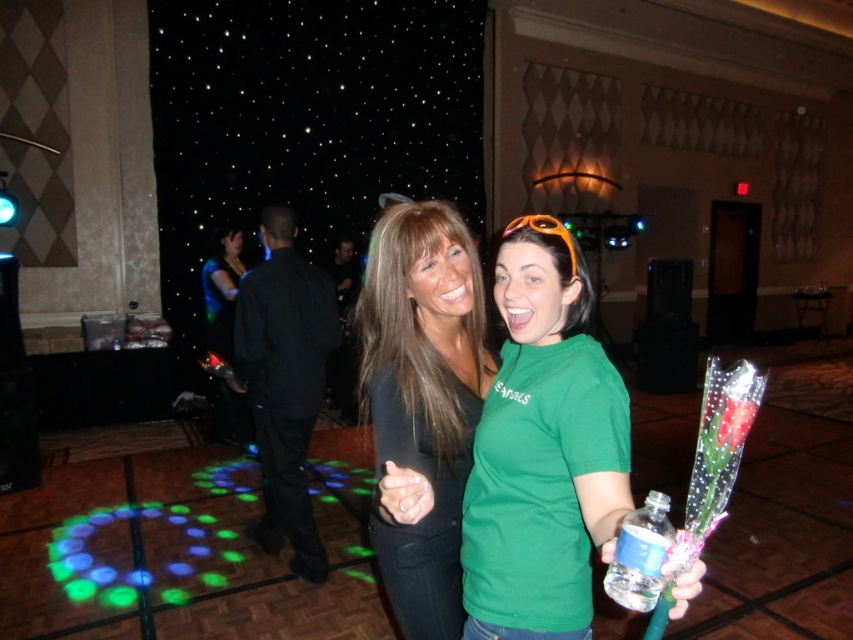
Question: Which point is farther to the camera?

Choices:
 (A) matte black top at center
 (B) clear plastic bottle at lower right
 (C) green matte shirt at center

Answer: (A)

Question: Which of these objects is positioned closest to the matte black top at center?

Choices:
 (A) clear plastic bottle at lower right
 (B) green matte shirt at center

Answer: (B)

Question: Is the position of matte black top at center more distant than that of clear plastic bottle at lower right?

Choices:
 (A) yes
 (B) no

Answer: (A)

Question: Is green matte shirt at center smaller than clear plastic bottle at lower right?

Choices:
 (A) no
 (B) yes

Answer: (A)

Question: Observing the image, what is the correct spatial positioning of green matte shirt at center in reference to clear plastic bottle at lower right?

Choices:
 (A) above
 (B) below

Answer: (A)

Question: Among these objects, which one is farthest from the camera?

Choices:
 (A) clear plastic bottle at lower right
 (B) green matte shirt at center

Answer: (B)